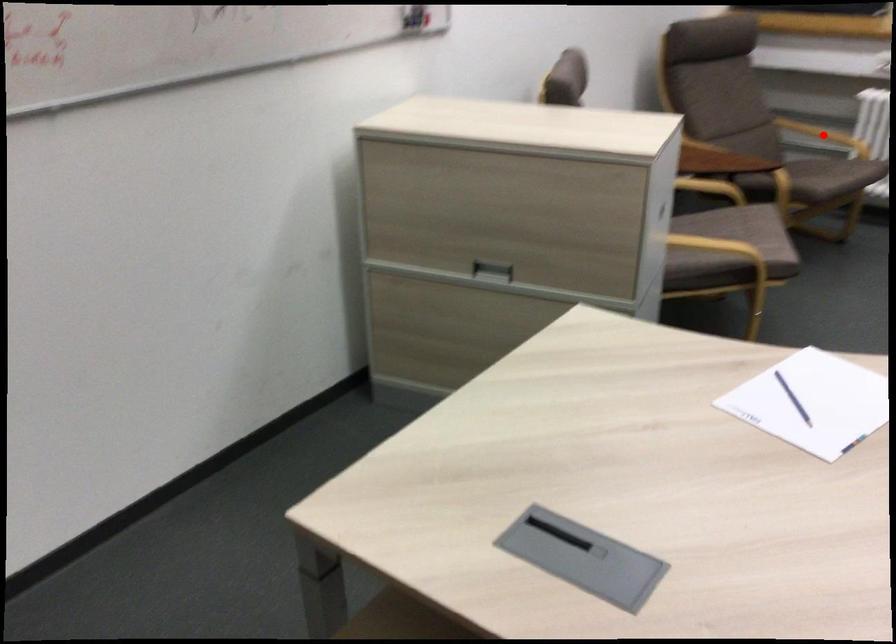
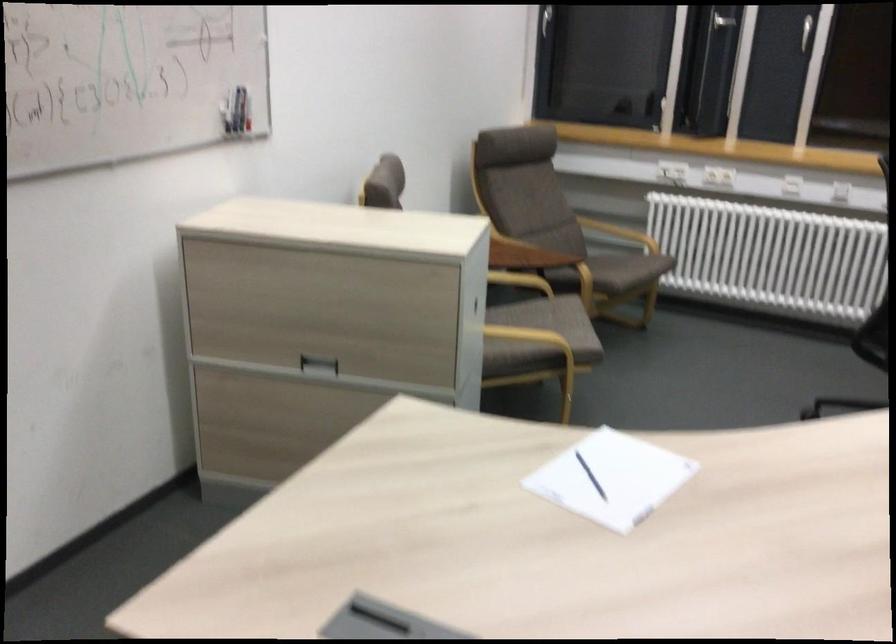
Locate, in the second image, the point that corresponds to the highlighted location in the first image.

(619, 232)